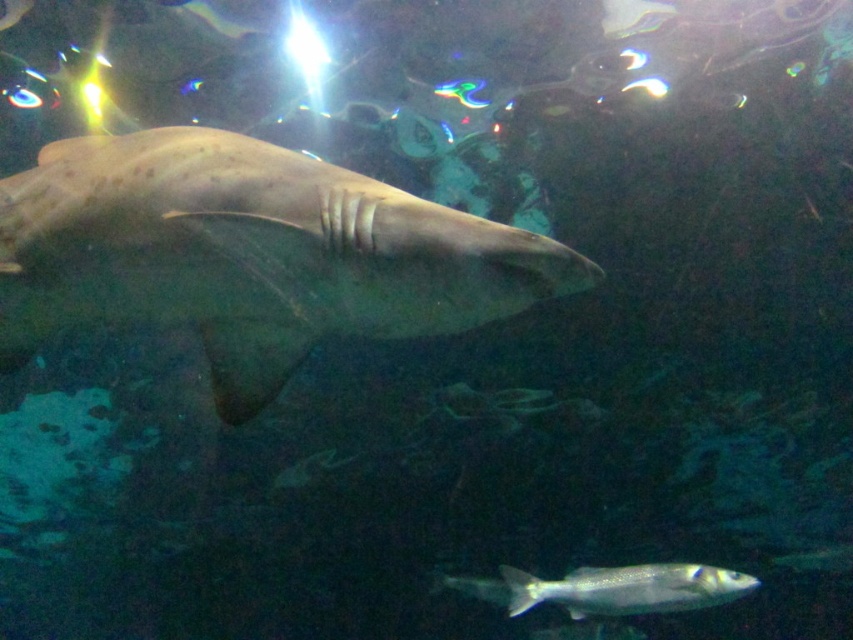
Between speckled tan shark at center and shiny silver fish at bottom right, which one has less height?

Standing shorter between the two is shiny silver fish at bottom right.

How much distance is there between speckled tan shark at center and shiny silver fish at bottom right?

7.56 feet

Is point (16, 173) in front of point (674, 584)?

Yes, point (16, 173) is closer to viewer.

Where is `speckled tan shark at center`? speckled tan shark at center is located at coordinates (248, 253).